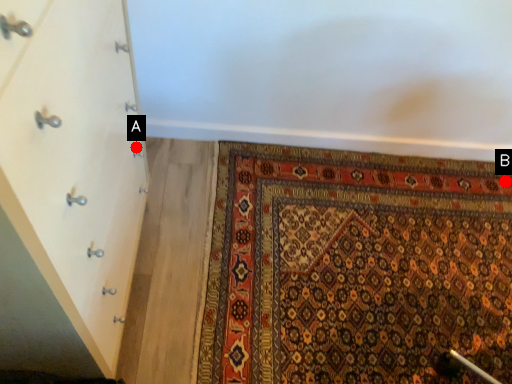
Question: Two points are circled on the image, labeled by A and B beside each circle. Which of the following is the farthest from the observer?

Choices:
 (A) A is further
 (B) B is further

Answer: (B)